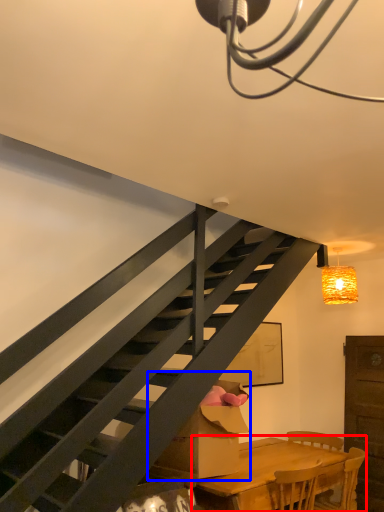
Question: Which point is closer to the camera, table (highlighted by a red box) or cardboard box (highlighted by a blue box)?

Choices:
 (A) table
 (B) cardboard box

Answer: (A)